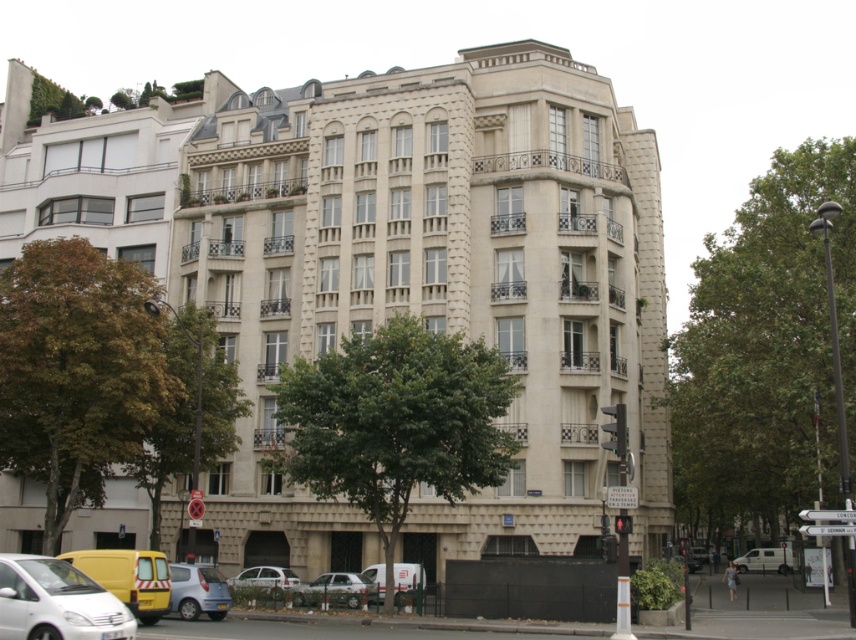
Consider the image. You are a delivery person who needs to park a white matte van at lower center and a white matte van at center in the parking lot behind the residential building. The parking spots are 2 meters wide. Can both vans fit into their respective spots?

The white matte van at lower center is thinner than the white matte van at center. Since the parking spots are 2 meters wide, both vans can fit as long as their widths are within the 2 meters. However, without knowing the exact width of each van, we cannot definitively confirm if both will fit. Please check the specific dimensions of each van.

You are a delivery person who needs to park your vehicle in the parking lot behind the residential building. The parking spot you want is between the yellow matte van at lower left and the white matte van at center. Since the parking spot is narrow, you need to know which van is larger to decide where to park. Which van is bigger?

The yellow matte van at lower left is bigger than the white matte van at center, so you should park closer to the white matte van at center to ensure enough space.

You are a delivery person driving a white matte van at lower left and need to park it next to the white matte van at lower center. Can you estimate if there is enough space between them to open the side doors of both vans simultaneously?

The white matte van at lower left is larger than the white matte van at lower center. Therefore, there might not be enough space between them to open both side doors simultaneously, as the larger van requires more space for its doors to open fully.